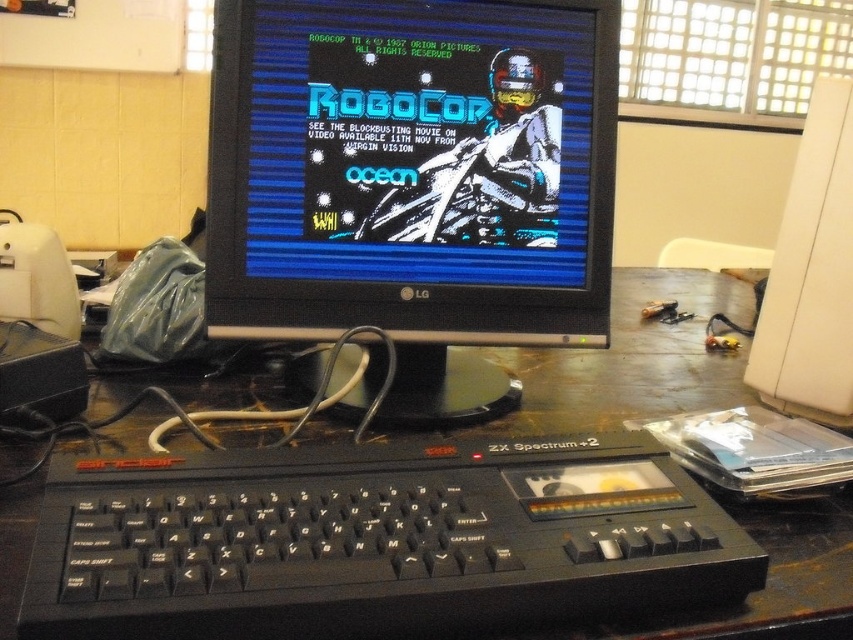
Looking at this image, you are setting up a retro computer display and need to place the black plastic computer desk at center and the white plastic monitor at right. According to the scene, which object should be placed to the left of the other?

The black plastic computer desk at center is positioned on the left side of white plastic monitor at right, so the desk should be placed to the left of the monitor.

You are setting up a desk for a retro computing display and need to place the black plastic keyboard at lower center and the white plastic monitor at right. Given that the desk has limited space, which object requires more horizontal space when placed side by side?

The black plastic keyboard at lower center requires more horizontal space because its width surpasses that of the white plastic monitor at right.

You are setting up a retro computing display and have a black plastic computer desk at center and a white plastic monitor at right. Which object should you place first if you want to arrange them according to their size?

The black plastic computer desk at center is larger than the white plastic monitor at right, so you should place the black plastic computer desk at center first to accommodate the larger object first in your setup.